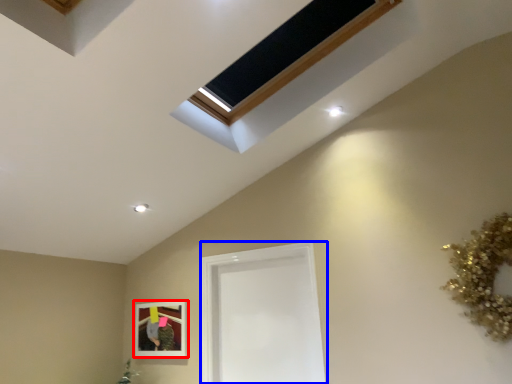
Question: Which object appears farthest to the camera in this image, picture frame (highlighted by a red box) or glass door (highlighted by a blue box)?

Choices:
 (A) picture frame
 (B) glass door

Answer: (A)